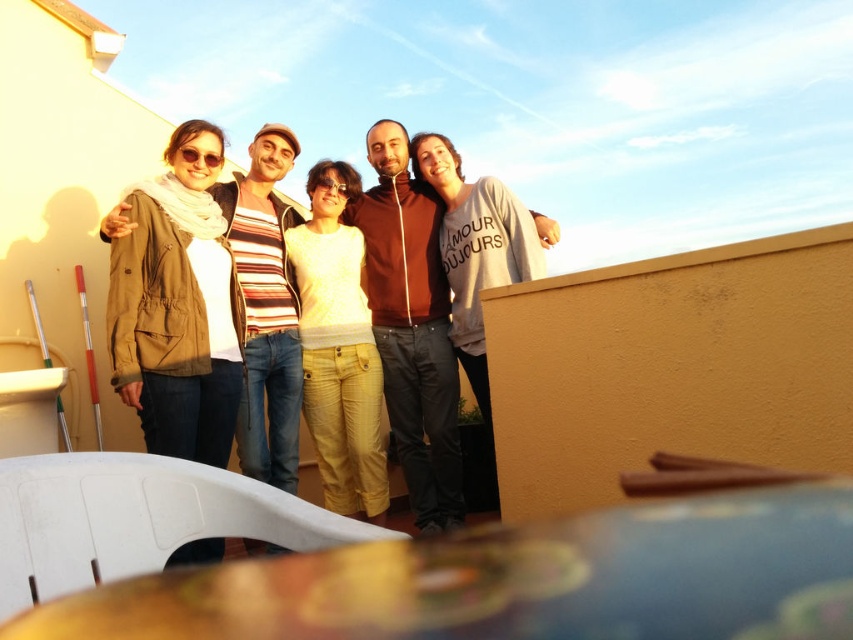
You are taking a photo of the matte brown hoodie at center and the matte brown jacket at center. Which one is positioned to the right side of the other?

The matte brown hoodie at center is positioned to the right of the matte brown jacket at center.

You are a photographer trying to decide which clothing item to focus on in the image. The matte brown jacket at center and the gray cotton sweatshirt at center are both in the frame. Which one would you choose if you want to highlight the larger clothing item?

The matte brown jacket at center is larger in size than the gray cotton sweatshirt at center, so you should choose the matte brown jacket at center to highlight the larger clothing item.